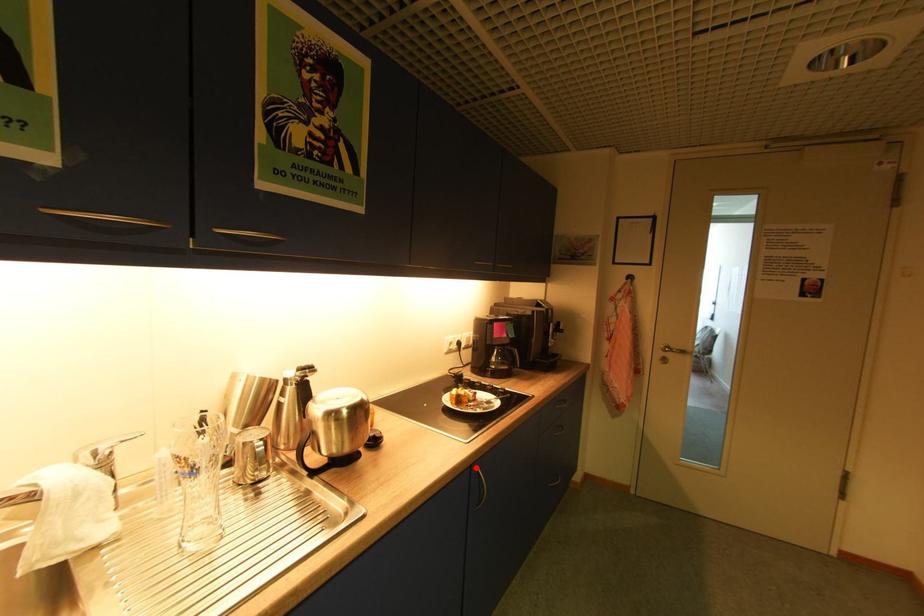
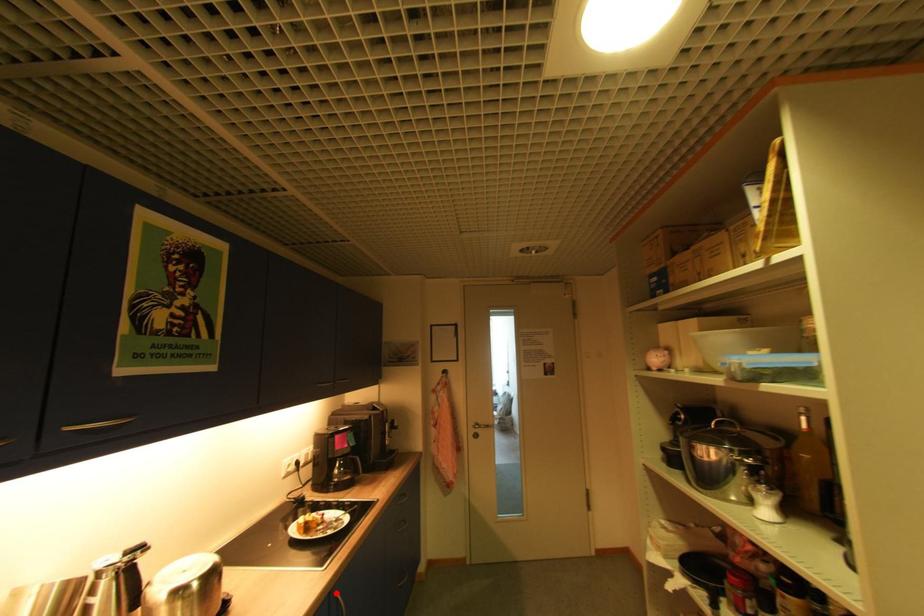
I am providing you with two images of the same scene from different viewpoints. A red point is marked on the first image and another point is marked on the second image. Is the red point in image1 aligned with the point shown in image2?

Yes